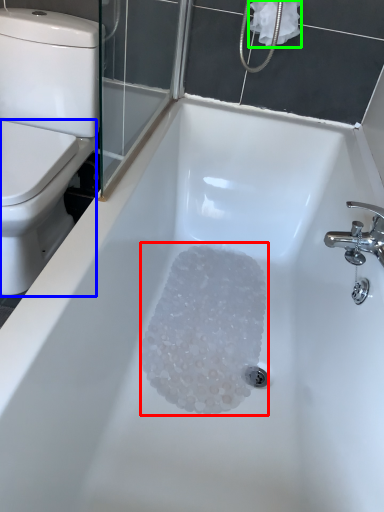
Question: Estimate the real-world distances between objects in this image. Which object is farther from crystal (highlighted by a red box), bidet (highlighted by a blue box) or toilet paper (highlighted by a green box)?

Choices:
 (A) bidet
 (B) toilet paper

Answer: (B)